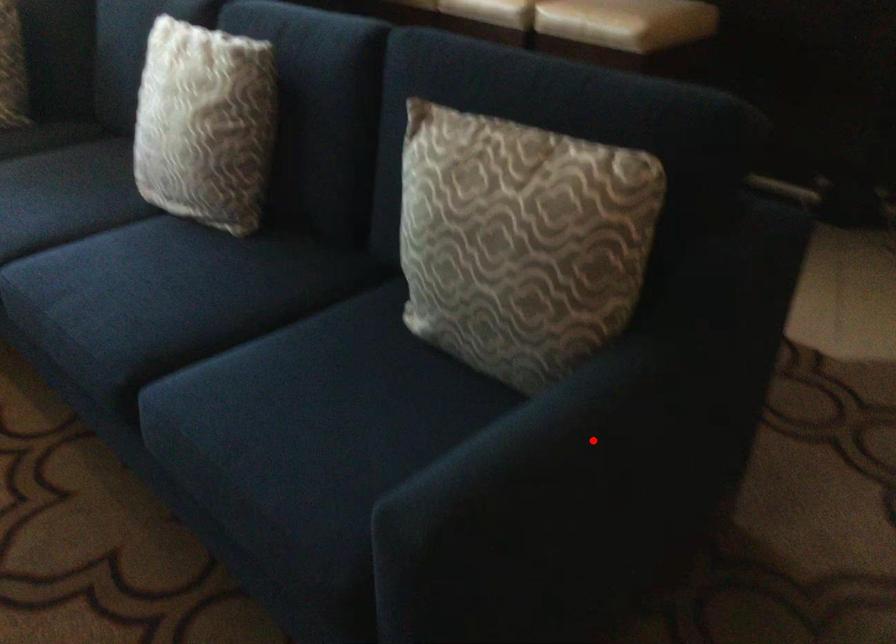
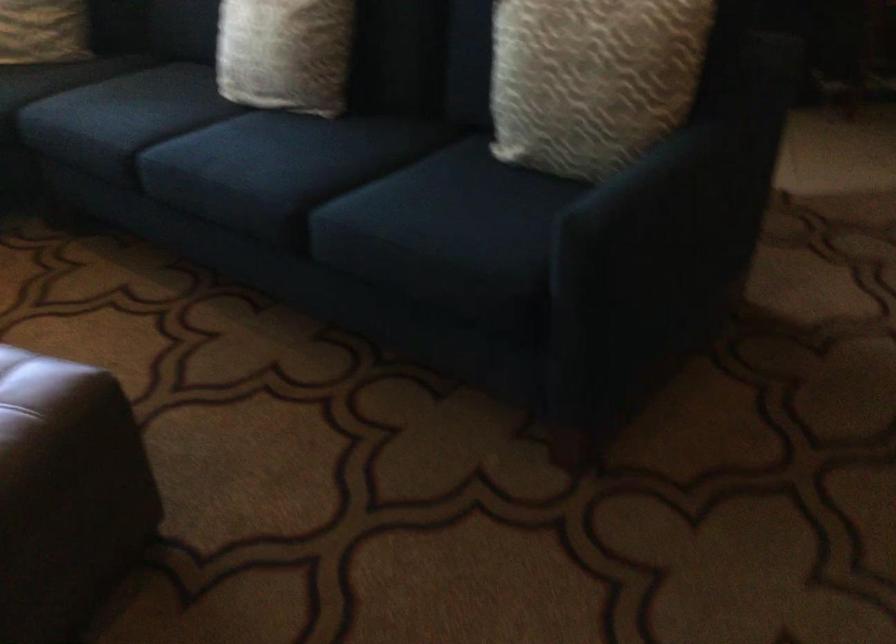
Question: A red point is marked in image1. In image2, is the corresponding 3D point closer to the camera or farther? Reply with the corresponding letter.

Choices:
 (A) The corresponding 3D point is closer.
 (B) The corresponding 3D point is farther.

Answer: (B)